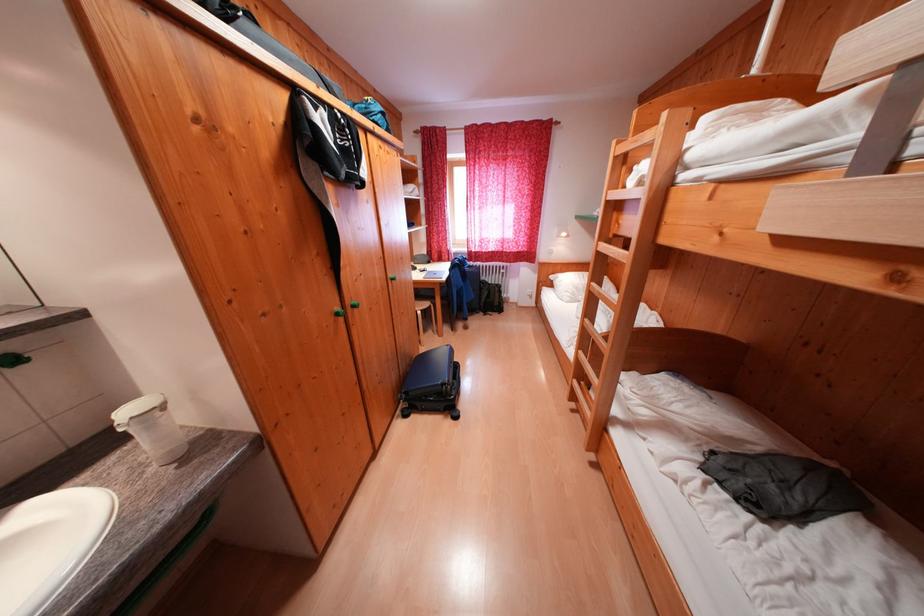
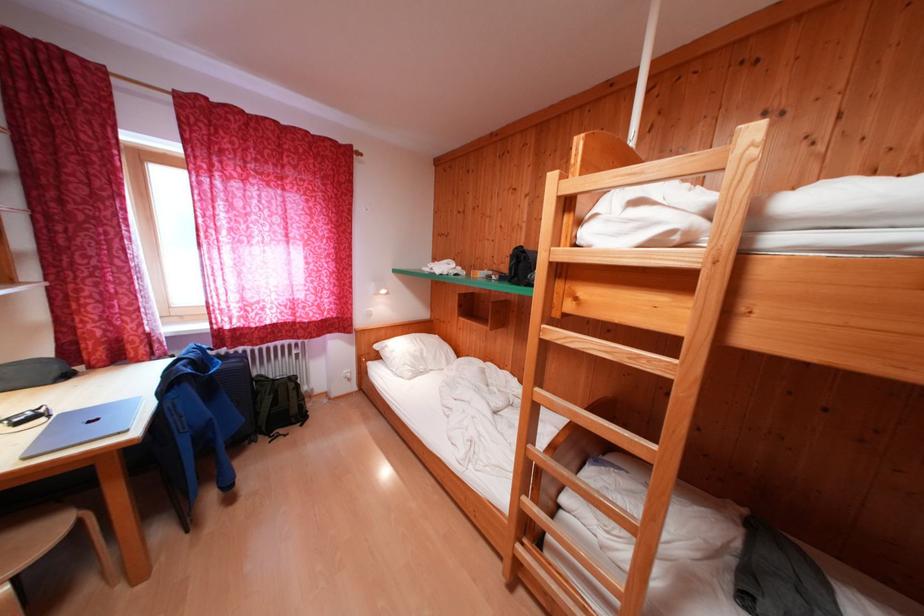
Find the pixel in the second image that matches point (433, 309) in the first image.

(55, 538)